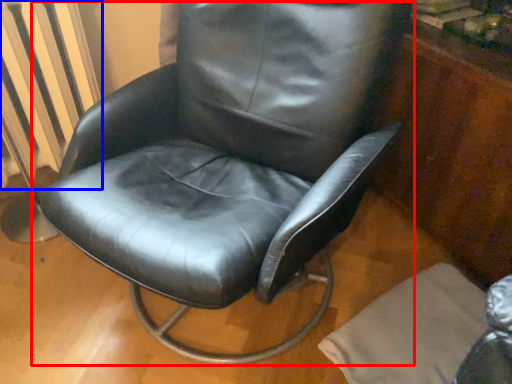
Question: Which of the following is the closest to the observer, chair (highlighted by a red box) or radiator (highlighted by a blue box)?

Choices:
 (A) chair
 (B) radiator

Answer: (A)